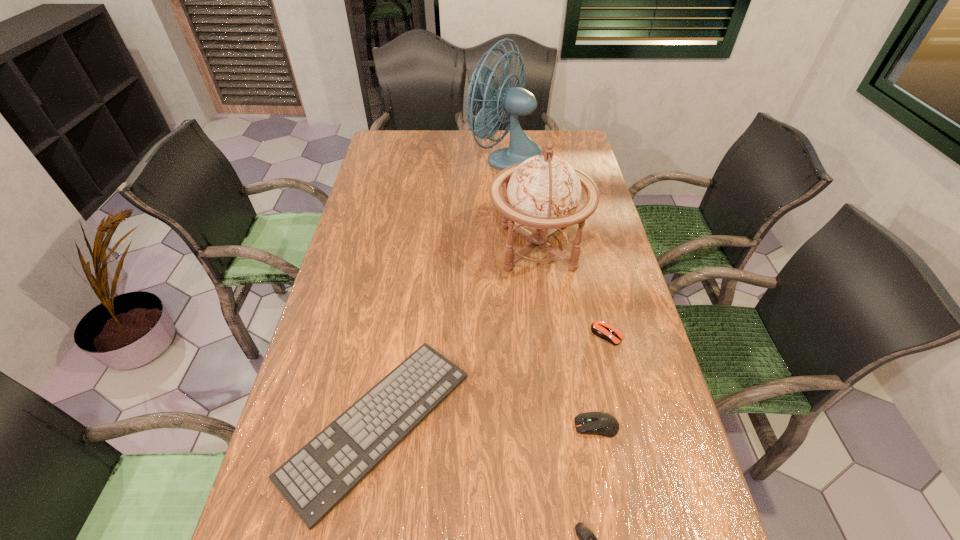
This screenshot has width=960, height=540. I want to click on object located at the left edge, so click(316, 478).

This screenshot has height=540, width=960. Identify the location of globe that is at the right edge. (543, 192).

The width and height of the screenshot is (960, 540). I want to click on free space at the far edge of the desktop, so click(541, 137).

At what (x,y) coordinates should I click in order to perform the action: click on free space at the left edge of the desktop. Please return your answer as a coordinate pair (x, y). This screenshot has height=540, width=960. Looking at the image, I should click on (372, 309).

Image resolution: width=960 pixels, height=540 pixels. Find the location of `vacant space at the right edge of the desktop`. vacant space at the right edge of the desktop is located at coordinates (621, 490).

At what (x,y) coordinates should I click in order to perform the action: click on unoccupied area between the farthest object and the computer keyboard. Please return your answer as a coordinate pair (x, y). The image size is (960, 540). Looking at the image, I should click on (443, 291).

This screenshot has height=540, width=960. Identify the location of free space between the farthest mouse and the third tallest object. (602, 380).

At what (x,y) coordinates should I click in order to perform the action: click on free area in between the second tallest mouse and the computer keyboard. Please return your answer as a coordinate pair (x, y). The image size is (960, 540). Looking at the image, I should click on (492, 380).

Locate an element on the screen. This screenshot has height=540, width=960. free space between the second tallest object and the second tallest mouse is located at coordinates (572, 291).

Find the location of a particular element. The image size is (960, 540). free spot between the globe and the tallest mouse is located at coordinates (566, 336).